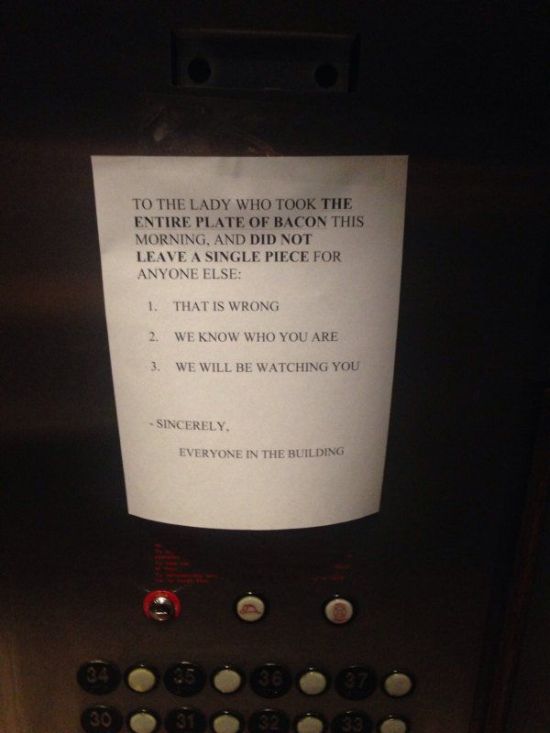
The height and width of the screenshot is (733, 550). What are the coordinates of `elevator button` in the screenshot? It's located at (141, 679), (147, 720), (229, 723), (310, 723), (392, 728), (395, 679), (311, 682), (227, 677), (251, 610), (340, 611).